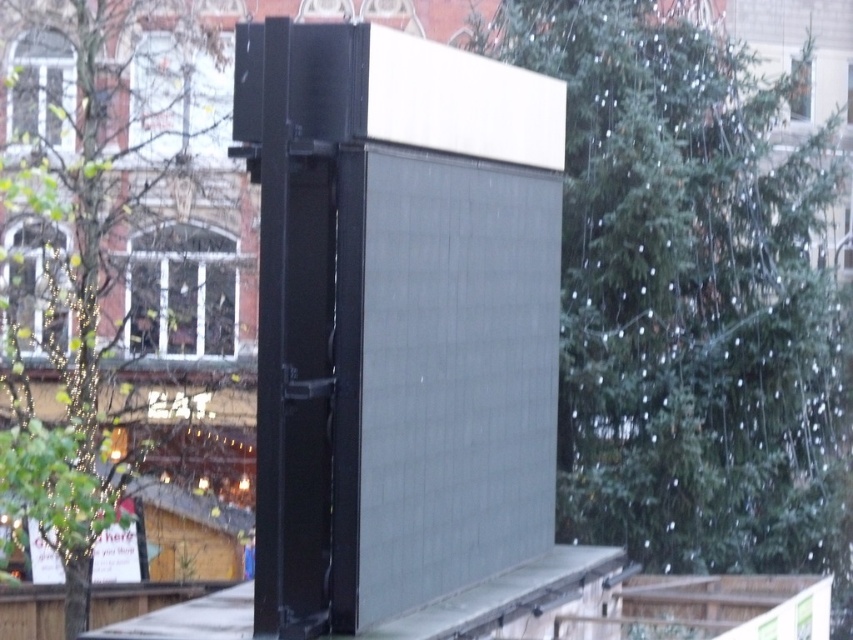
You are standing at the point labeled point (689, 296). Looking towards the black structure, is the green textured tree at center located to your left or right side?

The green textured tree at center is located at point (689, 296), which is directly where you are standing. Therefore, you are at the same position as the tree, so it cannot be to your left or right.

You are a city planner assessing the space between the green textured tree at center and the green leafy tree at left. If you need to install a bench that requires 2 meters of space, can the available space accommodate it?

The green textured tree at center might be wider than green leafy tree at left, so the space between them may be sufficient for a 2 meter bench. However, without exact measurements, it is uncertain.